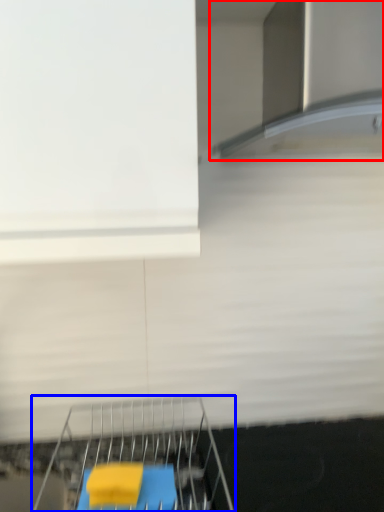
Question: Which of the following is the closest to the observer, exhaust hood (highlighted by a red box) or furniture (highlighted by a blue box)?

Choices:
 (A) exhaust hood
 (B) furniture

Answer: (A)